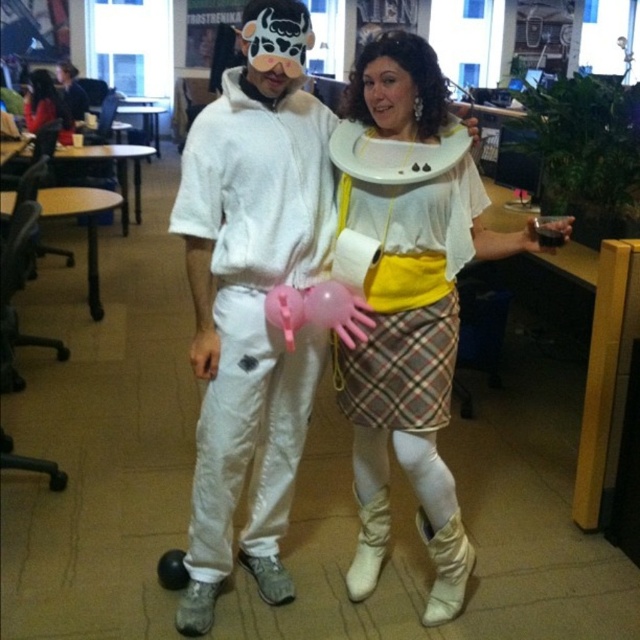
Question: Which point appears farthest from the camera in this image?

Choices:
 (A) (52, 109)
 (B) (317, 301)

Answer: (A)

Question: Can you confirm if matte white hoodie at center is bigger than pink rubber balloon at lower center?

Choices:
 (A) yes
 (B) no

Answer: (A)

Question: Can you confirm if matte black laptop at upper left is wider than pink rubber balloon at center?

Choices:
 (A) no
 (B) yes

Answer: (B)

Question: Can you confirm if white matte sweatshirt at center is positioned above pink rubber balloon at center?

Choices:
 (A) yes
 (B) no

Answer: (B)

Question: Which object is closer to the camera taking this photo?

Choices:
 (A) matte white hoodie at center
 (B) white matte sweatshirt at center
 (C) yellow plaid skirt at center

Answer: (B)

Question: Which point is farther to the camera?

Choices:
 (A) matte white hoodie at center
 (B) pink rubber balloon at lower center
 (C) matte black laptop at upper left
 (D) yellow plaid skirt at center

Answer: (A)